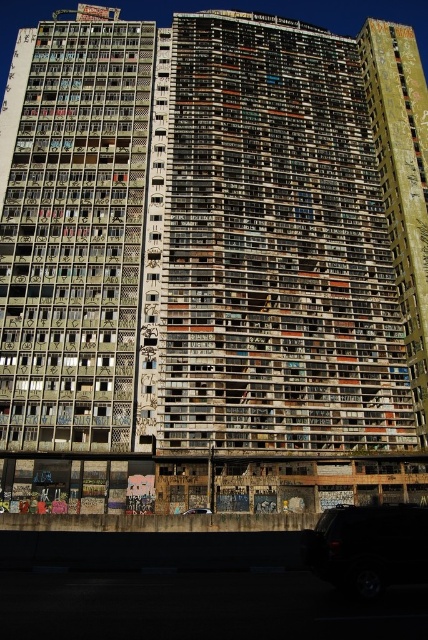
Question: Does shiny black suv at lower right have a lesser width compared to black matte car at lower center?

Choices:
 (A) yes
 (B) no

Answer: (B)

Question: Can you confirm if shiny black suv at lower right is positioned to the right of black matte car at lower center?

Choices:
 (A) no
 (B) yes

Answer: (B)

Question: Can you confirm if shiny black suv at lower right is wider than black matte car at lower center?

Choices:
 (A) yes
 (B) no

Answer: (A)

Question: Among these points, which one is farthest from the camera?

Choices:
 (A) (199, 508)
 (B) (365, 560)

Answer: (A)

Question: Which point appears farthest from the camera in this image?

Choices:
 (A) click(x=425, y=529)
 (B) click(x=199, y=509)

Answer: (B)